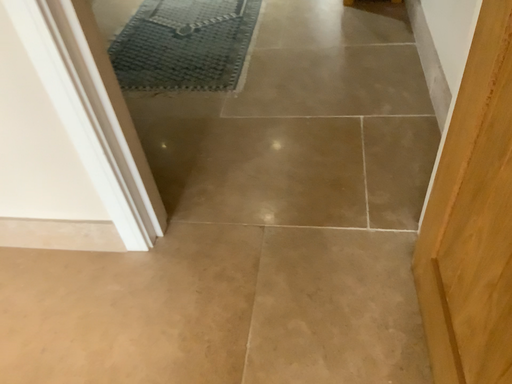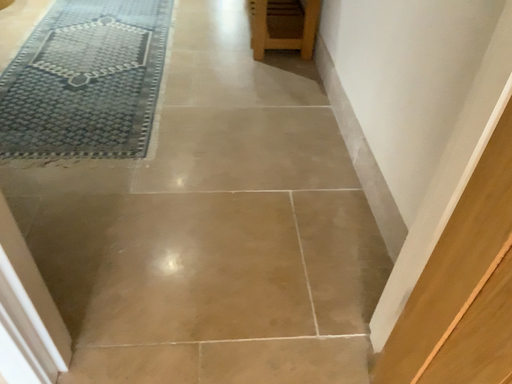
Question: How did the camera likely rotate when shooting the video?

Choices:
 (A) rotated right
 (B) rotated left

Answer: (A)